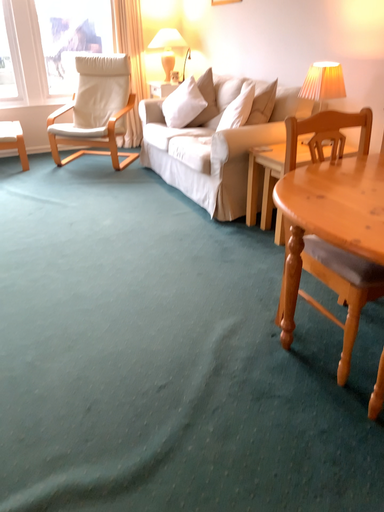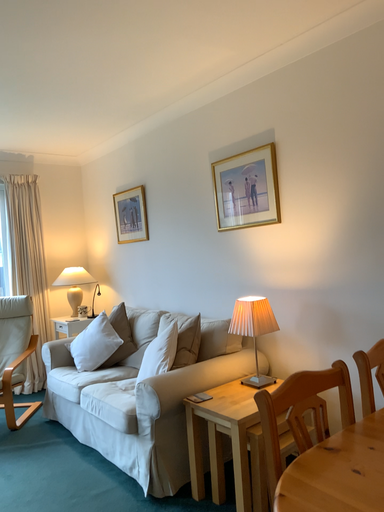
Question: How did the camera likely rotate when shooting the video?

Choices:
 (A) rotated left
 (B) rotated right

Answer: (B)